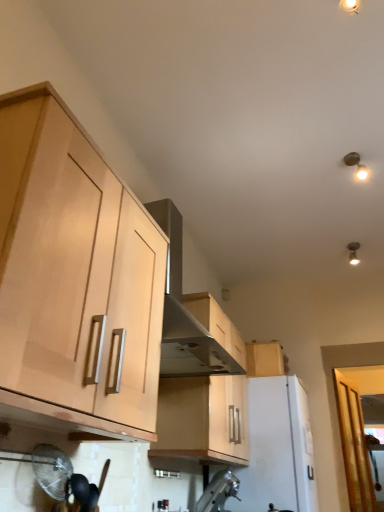
This screenshot has height=512, width=384. In order to click on stainless steel vent at upper center in this screenshot , I will do `click(192, 315)`.

What do you see at coordinates (203, 418) in the screenshot?
I see `wooden cabinet at center, which ranks as the second cabinetry in back-to-front order` at bounding box center [203, 418].

Locate an element on the screen. This screenshot has width=384, height=512. metallic silver faucet at lower center, the 2th appliance when ordered from back to front is located at coordinates (218, 492).

Where is `light wood cabinet at left, positioned as the first cabinetry in left-to-right order`? light wood cabinet at left, positioned as the first cabinetry in left-to-right order is located at coordinates (75, 275).

In order to face white matte refrigerator at center, which is the 2th appliance in front-to-back order, should I rotate leftwards or rightwards?

To face it directly, rotate right by 11.569 degrees.

This screenshot has width=384, height=512. I want to click on transparent glass door at lower right, so click(354, 448).

Considering the relative sizes of metallic ceiling light at upper right and white matte refrigerator at center, which is the 2th appliance in front-to-back order, in the image provided, is metallic ceiling light at upper right thinner than white matte refrigerator at center, which is the 2th appliance in front-to-back order,?

Yes.

How much distance is there between metallic ceiling light at upper right and white matte refrigerator at center, which is the 2th appliance in front-to-back order?

metallic ceiling light at upper right is 1.50 meters from white matte refrigerator at center, which is the 2th appliance in front-to-back order.

In the image, is metallic ceiling light at upper right on the left side or the right side of white matte refrigerator at center, which is the 2th appliance in front-to-back order?

Based on their positions, metallic ceiling light at upper right is located to the right of white matte refrigerator at center, which is the 2th appliance in front-to-back order.

Based on the photo, is metallic ceiling light at upper right not within white matte refrigerator at center, which is the 2th appliance in front-to-back order?

metallic ceiling light at upper right is positioned outside white matte refrigerator at center, which is the 2th appliance in front-to-back order.

From a real-world perspective, is metallic silver faucet at lower center, the 2th appliance when ordered from back to front, positioned above or below wooden cabinet at center, the 2th cabinetry positioned from the right?

In terms of real-world spatial position, metallic silver faucet at lower center, the 2th appliance when ordered from back to front, is below wooden cabinet at center, the 2th cabinetry positioned from the right.

In the image, is metallic silver faucet at lower center, the 2th appliance when ordered from back to front, positioned in front of or behind wooden cabinet at center, the second cabinetry when ordered from left to right?

In the image, metallic silver faucet at lower center, the 2th appliance when ordered from back to front, appears behind wooden cabinet at center, the second cabinetry when ordered from left to right.

Between metallic silver faucet at lower center, acting as the 1th appliance starting from the front, and wooden cabinet at center, which ranks as the second cabinetry in back-to-front order, which one has smaller size?

With smaller size is metallic silver faucet at lower center, acting as the 1th appliance starting from the front.

Is point (232, 474) in front of point (171, 439)?

No, (232, 474) is behind (171, 439).

In terms of height, does stainless steel vent at upper center look taller or shorter compared to wooden cabinet at center, marked as the 2th cabinetry in a front-to-back arrangement?

stainless steel vent at upper center is taller than wooden cabinet at center, marked as the 2th cabinetry in a front-to-back arrangement.

Is stainless steel vent at upper center oriented away from wooden cabinet at center, the 2th cabinetry positioned from the right?

stainless steel vent at upper center is not turned away from wooden cabinet at center, the 2th cabinetry positioned from the right.

From the picture: Is stainless steel vent at upper center not close to wooden cabinet at center, the second cabinetry when ordered from left to right?

No, stainless steel vent at upper center is not far from wooden cabinet at center, the second cabinetry when ordered from left to right.

From the image's perspective, is stainless steel vent at upper center positioned above or below wooden cabinet at center, the second cabinetry when ordered from left to right?

Based on their image positions, stainless steel vent at upper center is located above wooden cabinet at center, the second cabinetry when ordered from left to right.

Considering the relative sizes of metallic silver faucet at lower center, the 2th appliance when ordered from back to front, and stainless steel vent at upper center in the image provided, is metallic silver faucet at lower center, the 2th appliance when ordered from back to front, wider than stainless steel vent at upper center?

No.

Which object is further away from the camera, metallic silver faucet at lower center, acting as the 1th appliance starting from the front, or stainless steel vent at upper center?

metallic silver faucet at lower center, acting as the 1th appliance starting from the front, is further away from the camera.

At what (x,y) coordinates should I click in order to perform the action: click on vent in front of the metallic silver faucet at lower center, the 2th appliance when ordered from back to front. Please return your answer as a coordinate pair (x, y). This screenshot has height=512, width=384. Looking at the image, I should click on (192, 315).

From the image's perspective, relative to stainless steel vent at upper center, is metallic silver faucet at lower center, the 2th appliance when ordered from back to front, above or below?

Based on their image positions, metallic silver faucet at lower center, the 2th appliance when ordered from back to front, is located beneath stainless steel vent at upper center.

From a real-world perspective, is white matte refrigerator at center, which is the 2th appliance in front-to-back order, located higher than transparent glass door at lower right?

Actually, white matte refrigerator at center, which is the 2th appliance in front-to-back order, is physically below transparent glass door at lower right in the real world.

Which of these two, white matte refrigerator at center, which is the 2th appliance in front-to-back order, or transparent glass door at lower right, is bigger?

white matte refrigerator at center, which is the 2th appliance in front-to-back order.

Which point is more forward, [306,425] or [348,461]?

Point [306,425]

Could you tell me if light wood cabinet at left, positioned as the first cabinetry in left-to-right order, is turned towards white matte refrigerator at center, placed as the 1th appliance when sorted from back to front?

No, light wood cabinet at left, positioned as the first cabinetry in left-to-right order, is not aimed at white matte refrigerator at center, placed as the 1th appliance when sorted from back to front.

Is point (12, 365) closer or farther from the camera than point (278, 499)?

Point (12, 365) is closer to the camera than point (278, 499).

Considering the sizes of objects light wood cabinet at left, the 1th cabinetry from the front, and white matte refrigerator at center, placed as the 1th appliance when sorted from back to front, in the image provided, who is thinner, light wood cabinet at left, the 1th cabinetry from the front, or white matte refrigerator at center, placed as the 1th appliance when sorted from back to front,?

light wood cabinet at left, the 1th cabinetry from the front, is thinner.

There is a light wood cabinet at left, the 1th cabinetry from the front. At what (x,y) coordinates should I click in order to perform the action: click on the 1st appliance below it (from a real-world perspective). Please return your answer as a coordinate pair (x, y). Looking at the image, I should click on (277, 448).

From the image's perspective, which one is positioned lower, light wood cabinet at upper right, which ranks as the 1th cabinetry in right-to-left order, or light wood cabinet at left, placed as the 3th cabinetry when sorted from back to front?

light wood cabinet at upper right, which ranks as the 1th cabinetry in right-to-left order, from the image's perspective.

Who is shorter, light wood cabinet at upper right, the third cabinetry in the left-to-right sequence, or light wood cabinet at left, positioned as the first cabinetry in left-to-right order?

With less height is light wood cabinet at upper right, the third cabinetry in the left-to-right sequence.

From a real-world perspective, which object stands above the other?

In real-world perspective, light wood cabinet at upper right, which appears as the first cabinetry when viewed from the back, is above.

Where is `light fixture behind the white matte refrigerator at center, which is the 2th appliance in front-to-back order`? light fixture behind the white matte refrigerator at center, which is the 2th appliance in front-to-back order is located at coordinates (353, 253).

Which cabinetry is the 1st one when counting from the front of the metallic silver faucet at lower center, acting as the 1th appliance starting from the front? Please provide its 2D coordinates.

[(203, 418)]

Considering their positions, is transparent glass door at lower right positioned further to white matte refrigerator at center, placed as the 1th appliance when sorted from back to front, than light wood cabinet at upper right, placed as the third cabinetry when sorted from front to back?

transparent glass door at lower right is further to white matte refrigerator at center, placed as the 1th appliance when sorted from back to front.

From the image, which object appears to be nearer to transparent glass door at lower right, light wood cabinet at left, the 3th cabinetry when ordered from right to left, or white matte refrigerator at center, which is the 2th appliance in front-to-back order?

white matte refrigerator at center, which is the 2th appliance in front-to-back order, lies closer to transparent glass door at lower right than the other object.

Which object lies further to the anchor point wooden cabinet at center, marked as the 2th cabinetry in a front-to-back arrangement, stainless steel vent at upper center or metallic silver faucet at lower center, the 2th appliance when ordered from back to front?

metallic silver faucet at lower center, the 2th appliance when ordered from back to front.

Estimate the real-world distances between objects in this image. Which object is closer to transparent glass door at lower right, metallic silver faucet at lower center, acting as the 1th appliance starting from the front, or wooden cabinet at center, which ranks as the second cabinetry in back-to-front order?

The object closer to transparent glass door at lower right is metallic silver faucet at lower center, acting as the 1th appliance starting from the front.

Which object lies further to the anchor point transparent glass door at lower right, metallic silver faucet at lower center, the 2th appliance when ordered from back to front, or stainless steel vent at upper center?

Among the two, stainless steel vent at upper center is located further to transparent glass door at lower right.

From the image, which object appears to be nearer to white matte refrigerator at center, placed as the 1th appliance when sorted from back to front, light wood cabinet at upper right, placed as the third cabinetry when sorted from front to back, or transparent glass door at lower right?

light wood cabinet at upper right, placed as the third cabinetry when sorted from front to back, is closer to white matte refrigerator at center, placed as the 1th appliance when sorted from back to front.

Based on their spatial positions, is metallic silver faucet at lower center, the 2th appliance when ordered from back to front, or light wood cabinet at left, the 1th cabinetry from the front, closer to white matte refrigerator at center, which is the 2th appliance in front-to-back order?

metallic silver faucet at lower center, the 2th appliance when ordered from back to front, is positioned closer to the anchor white matte refrigerator at center, which is the 2th appliance in front-to-back order.

When comparing their distances from light wood cabinet at upper right, placed as the third cabinetry when sorted from front to back, does transparent glass door at lower right or wooden cabinet at center, which ranks as the second cabinetry in back-to-front order, seem further?

transparent glass door at lower right lies further to light wood cabinet at upper right, placed as the third cabinetry when sorted from front to back, than the other object.

I want to click on appliance between metallic silver faucet at lower center, acting as the 1th appliance starting from the front, and transparent glass door at lower right in the front-back direction, so click(277, 448).

The height and width of the screenshot is (512, 384). I want to click on cabinetry located between light wood cabinet at left, the 1th cabinetry from the front, and metallic silver faucet at lower center, acting as the 1th appliance starting from the front, in the depth direction, so click(x=203, y=418).

Locate an element on the screen. The image size is (384, 512). light fixture between wooden cabinet at center, marked as the 2th cabinetry in a front-to-back arrangement, and transparent glass door at lower right in the front-back direction is located at coordinates (353, 253).

You are a GUI agent. You are given a task and a screenshot of the screen. Output one action in this format:
    pyautogui.click(x=<x>, y=<y>)
    Task: Click on the vent between light wood cabinet at left, the 1th cabinetry from the front, and light wood cabinet at upper right, the third cabinetry in the left-to-right sequence, in the front-back direction
    The width and height of the screenshot is (384, 512).
    Given the screenshot: What is the action you would take?
    pyautogui.click(x=192, y=315)